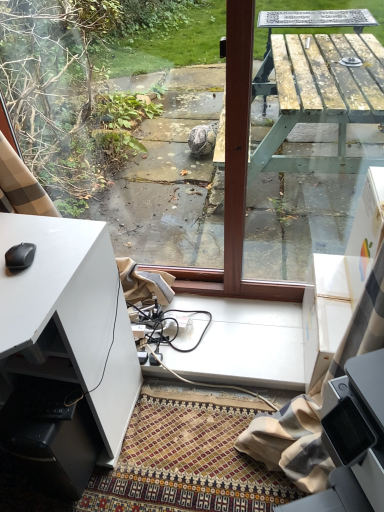
Question: From the image's perspective, is wooden picnic table at center on black matte mouse at lower left?

Choices:
 (A) no
 (B) yes

Answer: (B)

Question: Considering the relative sizes of wooden picnic table at center and black matte mouse at lower left in the image provided, is wooden picnic table at center bigger than black matte mouse at lower left?

Choices:
 (A) yes
 (B) no

Answer: (A)

Question: From a real-world perspective, does wooden picnic table at center stand above black matte mouse at lower left?

Choices:
 (A) yes
 (B) no

Answer: (B)

Question: Is wooden picnic table at center taller than black matte mouse at lower left?

Choices:
 (A) yes
 (B) no

Answer: (A)

Question: From the image's perspective, is wooden picnic table at center below black matte mouse at lower left?

Choices:
 (A) no
 (B) yes

Answer: (A)

Question: Is point (67, 270) positioned closer to the camera than point (317, 112)?

Choices:
 (A) farther
 (B) closer

Answer: (B)

Question: Looking at their shapes, would you say white matte desk at lower left is wider or thinner than wooden picnic table at center?

Choices:
 (A) thin
 (B) wide

Answer: (B)

Question: Do you think white matte desk at lower left is within wooden picnic table at center, or outside of it?

Choices:
 (A) outside
 (B) inside

Answer: (A)

Question: From the image's perspective, is white matte desk at lower left positioned above or below wooden picnic table at center?

Choices:
 (A) below
 (B) above

Answer: (A)

Question: Is wooden picnic table at center wider or thinner than black matte mouse at lower left?

Choices:
 (A) wide
 (B) thin

Answer: (A)

Question: Is wooden picnic table at center taller or shorter than black matte mouse at lower left?

Choices:
 (A) short
 (B) tall

Answer: (B)

Question: Considering their positions, is wooden picnic table at center located in front of or behind black matte mouse at lower left?

Choices:
 (A) behind
 (B) front

Answer: (B)

Question: Is wooden picnic table at center spatially inside black matte mouse at lower left, or outside of it?

Choices:
 (A) inside
 (B) outside

Answer: (B)

Question: Looking at the image, does black matte mouse at lower left seem bigger or smaller compared to white matte desk at lower left?

Choices:
 (A) small
 (B) big

Answer: (A)

Question: From the image's perspective, relative to white matte desk at lower left, is black matte mouse at lower left above or below?

Choices:
 (A) below
 (B) above

Answer: (B)